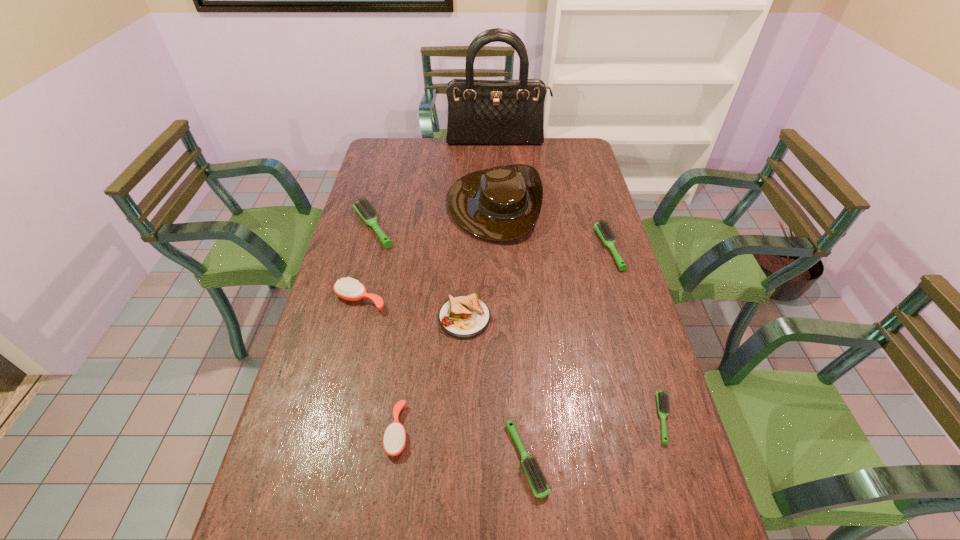
Image resolution: width=960 pixels, height=540 pixels. What are the coordinates of `the third hairbrush from right to left` in the screenshot? It's located at (539, 485).

Locate an element on the screen. The width and height of the screenshot is (960, 540). the second light hairbrush from left to right is located at coordinates (539, 485).

Locate an element on the screen. the shortest hairbrush is located at coordinates pyautogui.click(x=662, y=398).

Locate an element on the screen. the shortest object is located at coordinates (662, 398).

This screenshot has height=540, width=960. Identify the location of free spot located 0.320m with an open clasp on the front of the farthest object. (499, 190).

Image resolution: width=960 pixels, height=540 pixels. Identify the location of vacant space situated 0.060m on the right of the second tallest object. (556, 204).

Where is `free point located on the front of the fourth nearest hairbrush`? The image size is (960, 540). free point located on the front of the fourth nearest hairbrush is located at coordinates (352, 334).

Where is `free location located on the front of the biggest light hairbrush`? free location located on the front of the biggest light hairbrush is located at coordinates (363, 266).

Where is `vacant space positioned on the back of the second biggest light hairbrush`? The width and height of the screenshot is (960, 540). vacant space positioned on the back of the second biggest light hairbrush is located at coordinates (592, 192).

You are a GUI agent. You are given a task and a screenshot of the screen. Output one action in this format:
    pyautogui.click(x=<x>, y=<y>)
    Task: Click on the vacant region located 0.270m on the front of the beige sandwich
    Image resolution: width=960 pixels, height=540 pixels.
    Given the screenshot: What is the action you would take?
    pyautogui.click(x=461, y=433)